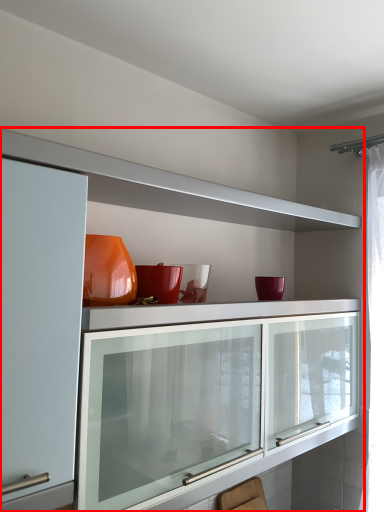
Question: From the image's perspective, where is cabinetry (annotated by the red box) located relative to swivel chair?

Choices:
 (A) above
 (B) below

Answer: (A)